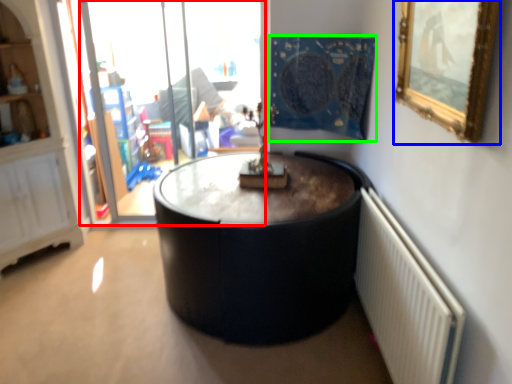
Question: Which object is positioned closest to glass door (highlighted by a red box)? Select from picture frame (highlighted by a blue box) and tapestry (highlighted by a green box).

Choices:
 (A) picture frame
 (B) tapestry

Answer: (B)